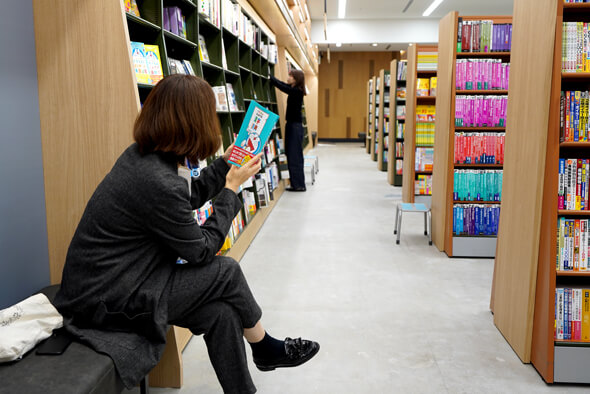
This screenshot has height=394, width=590. I want to click on white floor, so click(389, 297).